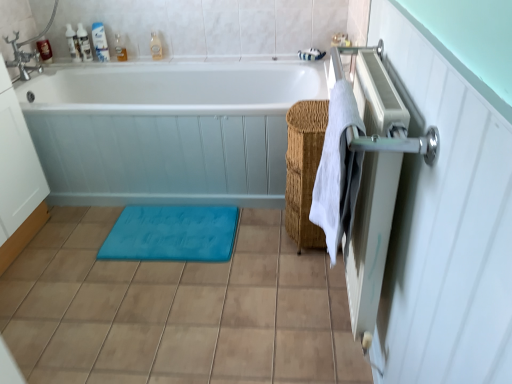
The height and width of the screenshot is (384, 512). In order to click on vacant space to the right of blue rubber bath mat at center in this screenshot , I will do `click(264, 243)`.